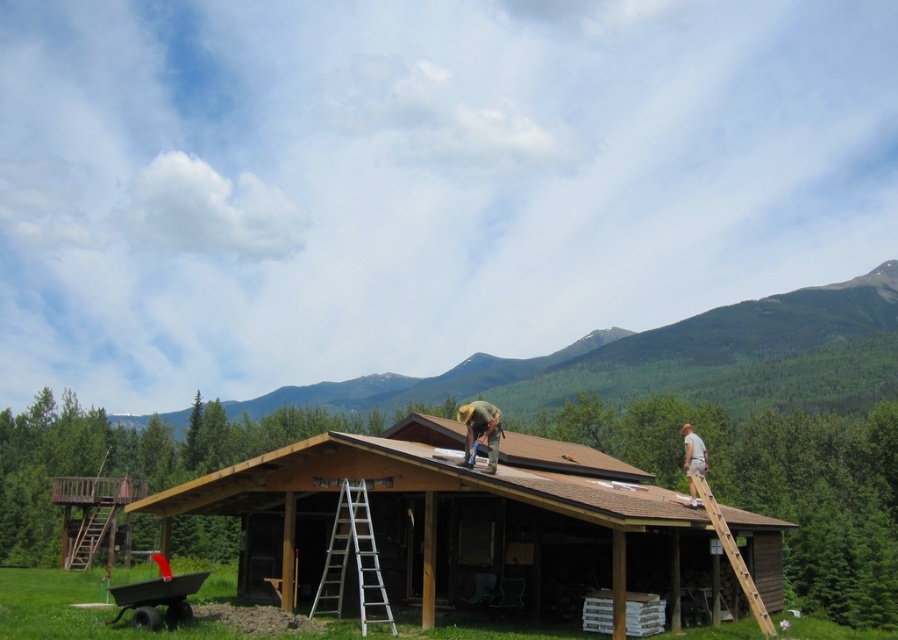
Question: Is green fabric construction worker at center further to the viewer compared to green fabric shirt at upper right?

Choices:
 (A) yes
 (B) no

Answer: (B)

Question: Does brown wooden cabin at center appear over brown wooden roof at center?

Choices:
 (A) yes
 (B) no

Answer: (B)

Question: Which of the following is the farthest from the observer?

Choices:
 (A) silver metallic ladder at lower center
 (B) brown wooden cabin at center

Answer: (A)

Question: Does silver metallic ladder at lower center have a larger size compared to green fabric construction worker at center?

Choices:
 (A) no
 (B) yes

Answer: (A)

Question: Which object is positioned closest to the green fabric shirt at upper right?

Choices:
 (A) silver metallic ladder at lower center
 (B) brown wooden roof at center
 (C) brown wooden cabin at center

Answer: (C)

Question: Which of the following is the closest to the observer?

Choices:
 (A) (330, 465)
 (B) (481, 435)

Answer: (B)